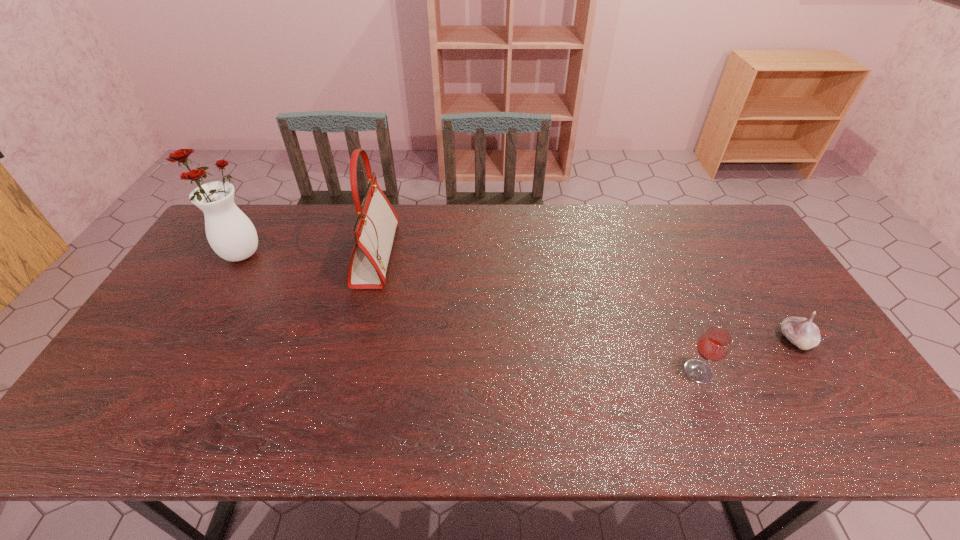
This screenshot has height=540, width=960. Find the location of `empty location between the vase and the handbag`. empty location between the vase and the handbag is located at coordinates click(x=308, y=254).

Image resolution: width=960 pixels, height=540 pixels. I want to click on vacant area between the handbag and the leftmost object, so [x=308, y=254].

The height and width of the screenshot is (540, 960). In order to click on vacant point located between the rightmost object and the vase in this screenshot , I will do (517, 297).

You are a GUI agent. You are given a task and a screenshot of the screen. Output one action in this format:
    pyautogui.click(x=<x>, y=<y>)
    Task: Click on the vacant region between the third tallest object and the rightmost object
    
    Given the screenshot: What is the action you would take?
    pyautogui.click(x=747, y=356)

You are a GUI agent. You are given a task and a screenshot of the screen. Output one action in this format:
    pyautogui.click(x=<x>, y=<y>)
    Task: Click on the vacant region between the second object from left to right and the vase
    The width and height of the screenshot is (960, 540).
    Given the screenshot: What is the action you would take?
    pyautogui.click(x=308, y=254)

The image size is (960, 540). Find the location of `vacant space that is in between the rightmost object and the third object from right to left`. vacant space that is in between the rightmost object and the third object from right to left is located at coordinates (586, 298).

The image size is (960, 540). I want to click on free spot between the vase and the second object from left to right, so click(x=308, y=254).

You are a GUI agent. You are given a task and a screenshot of the screen. Output one action in this format:
    pyautogui.click(x=<x>, y=<y>)
    Task: Click on the vacant space in between the nearest object and the vase
    This screenshot has width=960, height=540.
    Given the screenshot: What is the action you would take?
    pyautogui.click(x=469, y=313)

What are the coordinates of `free space between the leftmost object and the third object from right to left` in the screenshot? It's located at (308, 254).

This screenshot has height=540, width=960. Find the location of `free space between the third tallest object and the vase`. free space between the third tallest object and the vase is located at coordinates (469, 313).